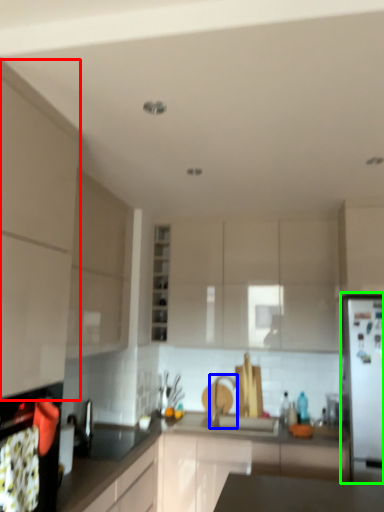
Question: Which object is positioned closest to cabinetry (highlighted by a red box)? Select from tap (highlighted by a blue box) and fridge (highlighted by a green box).

Choices:
 (A) tap
 (B) fridge

Answer: (B)